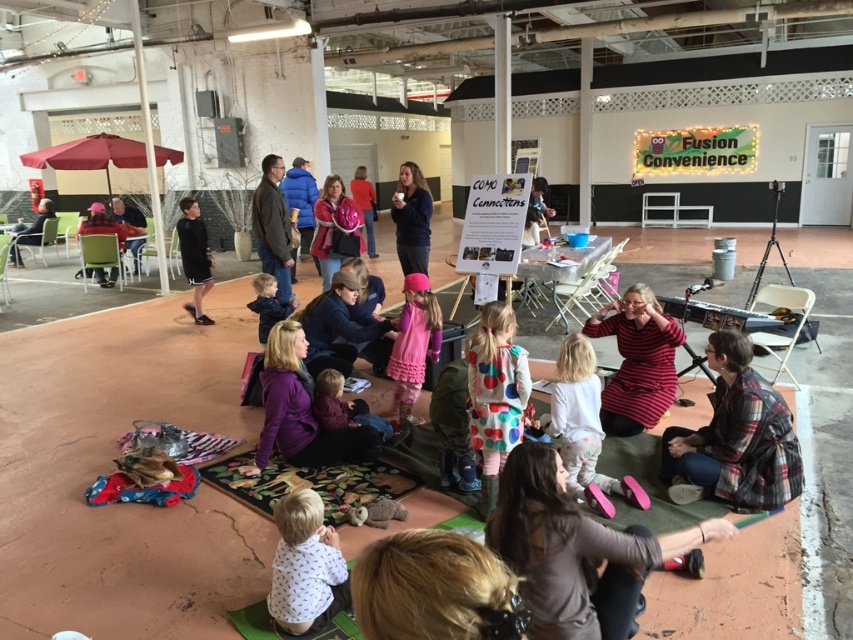
Does dark brown leather jacket at lower center appear on the right side of matte black shorts at left?

Yes, dark brown leather jacket at lower center is to the right of matte black shorts at left.

Is dark brown leather jacket at lower center taller than matte black shorts at left?

No.

Which is behind, point (679, 532) or point (190, 204)?

Positioned behind is point (190, 204).

Image resolution: width=853 pixels, height=640 pixels. In order to click on dark brown leather jacket at lower center in this screenshot , I will do `click(573, 550)`.

Is matte black jacket at center positioned behind dark blue fleece jacket at center?

Yes, it is.

Locate an element on the screen. matte black jacket at center is located at coordinates (410, 218).

Is point (395, 196) less distant than point (280, 307)?

No, (395, 196) is behind (280, 307).

Find the location of `matte black jacket at center`. matte black jacket at center is located at coordinates (410, 218).

Describe the element at coordinates (573, 550) in the screenshot. I see `dark brown leather jacket at lower center` at that location.

Between dark brown leather jacket at lower center and plaid flannel shirt at lower right, which one appears on the right side from the viewer's perspective?

From the viewer's perspective, plaid flannel shirt at lower right appears more on the right side.

Find the location of a particular element. The width and height of the screenshot is (853, 640). dark brown leather jacket at lower center is located at coordinates (573, 550).